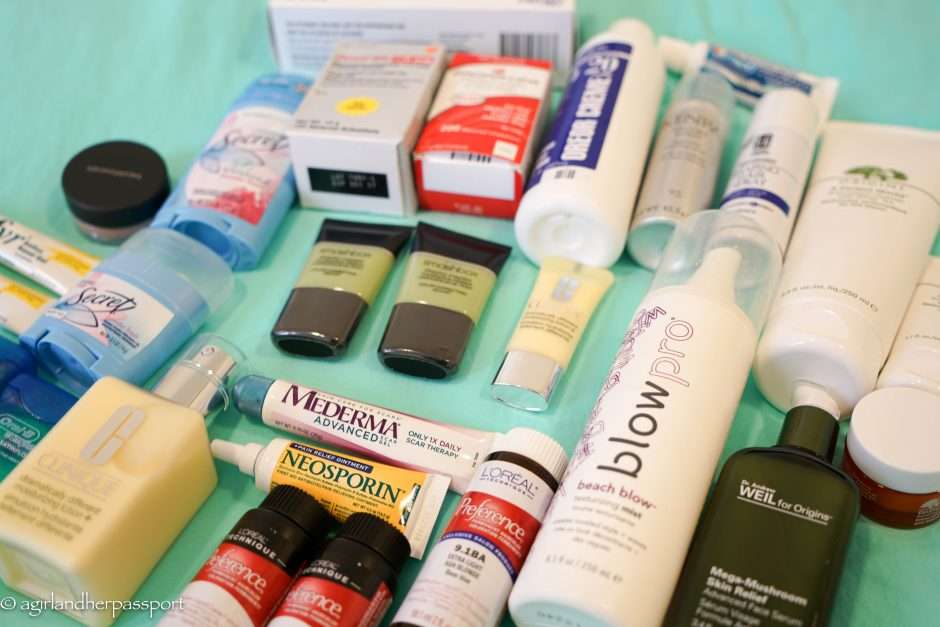
Find the location of a particular element. table cloth is located at coordinates (154, 88).